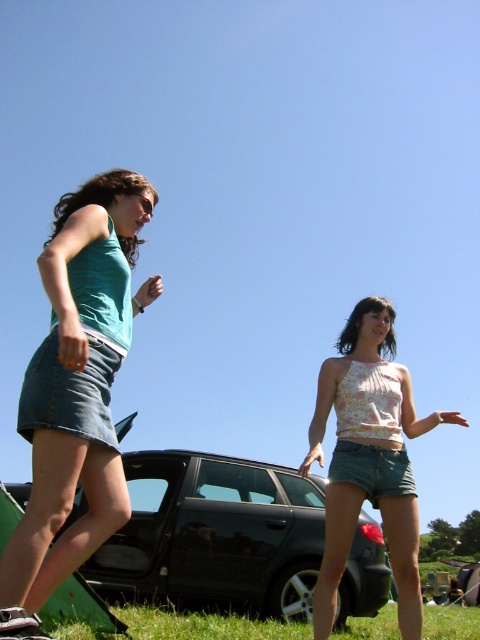
You are a photographer trying to capture a photo of the green grass at lower center. However, the floral fabric top at center is blocking your view. Which direction should you move to avoid the obstruction?

Move to the right side to avoid the floral fabric top at center, since it is to the left of the green grass at lower center.

You are standing in front of the two points marked in the image. Which point, point [360,342] or point [190,627], is nearer to you?

Point [360,342] is closer to the viewer than point [190,627].